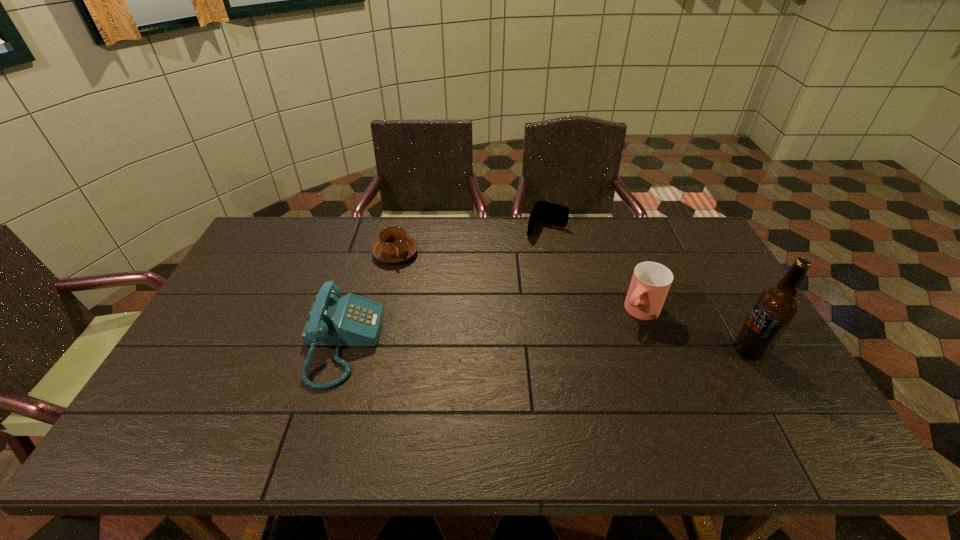
Where is `the third tallest object`? the third tallest object is located at coordinates (352, 320).

Identify the location of the tallest object. (775, 308).

Identify the location of the rightmost object. Image resolution: width=960 pixels, height=540 pixels. (775, 308).

Locate an element on the screen. This screenshot has width=960, height=540. the fourth object from left to right is located at coordinates (651, 281).

Locate an element on the screen. This screenshot has width=960, height=540. cappuccino is located at coordinates (394, 245).

Where is `wallet`? Image resolution: width=960 pixels, height=540 pixels. wallet is located at coordinates (543, 211).

I want to click on the farthest object, so click(543, 211).

Identify the location of vacant region located 0.260m on the dial of the third tallest object. Image resolution: width=960 pixels, height=540 pixels. (473, 343).

Where is `free space located on the label of the tallest object`? This screenshot has width=960, height=540. free space located on the label of the tallest object is located at coordinates (601, 350).

Locate an element on the screen. free space located on the label of the tallest object is located at coordinates (609, 350).